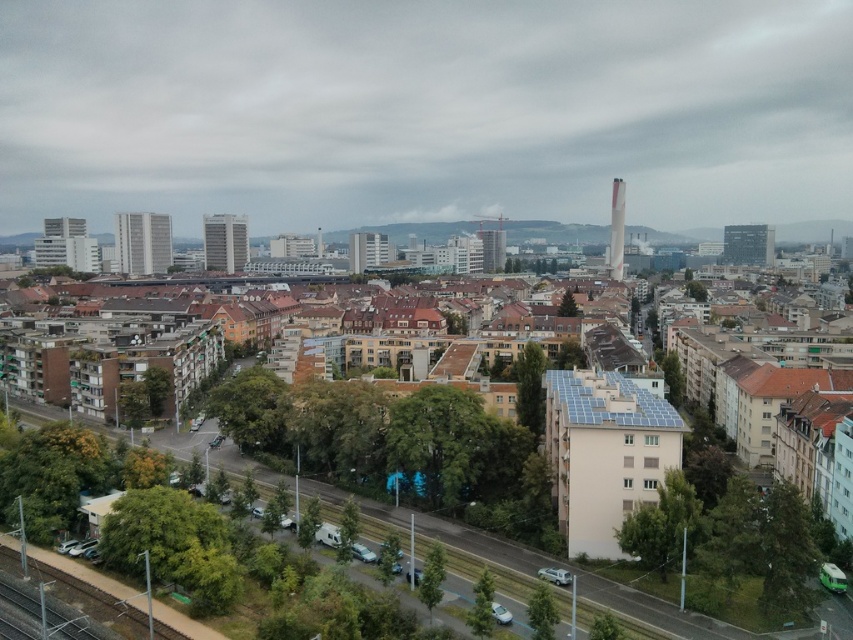
Question: Does green metallic train track at lower left have a smaller size compared to matte glass building at center?

Choices:
 (A) no
 (B) yes

Answer: (B)

Question: Considering the relative positions of green metallic train track at lower left and matte gray building at center in the image provided, where is green metallic train track at lower left located with respect to matte gray building at center?

Choices:
 (A) above
 (B) below

Answer: (B)

Question: Can you confirm if green metallic train track at lower left is smaller than white glass building at center?

Choices:
 (A) no
 (B) yes

Answer: (B)

Question: Which object is positioned closest to the green metallic train track at lower left?

Choices:
 (A) matte gray building at center
 (B) dark gray glass building at upper right

Answer: (A)

Question: Which of the following is the closest to the observer?

Choices:
 (A) (120, 253)
 (B) (368, 259)

Answer: (B)

Question: Among these points, which one is farthest from the camera?

Choices:
 (A) (770, 262)
 (B) (492, 250)

Answer: (A)